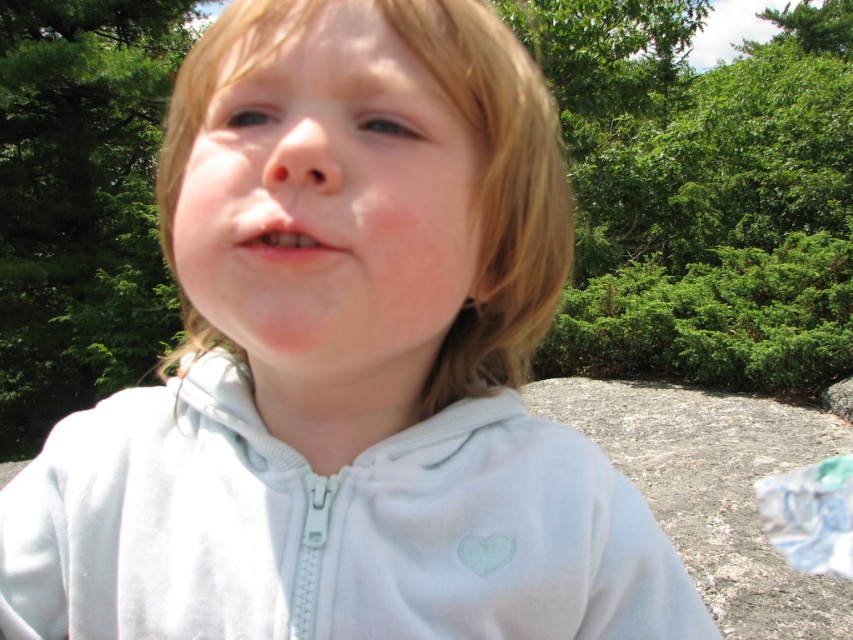
Can you confirm if light blue fleece sweatshirt at center is shorter than pink matte lips at center?

In fact, light blue fleece sweatshirt at center may be taller than pink matte lips at center.

Who is lower down, light blue fleece sweatshirt at center or pink matte lips at center?

light blue fleece sweatshirt at center is below.

Is point (155, 552) in front of point (265, 221)?

No.

Image resolution: width=853 pixels, height=640 pixels. Identify the location of light blue fleece sweatshirt at center. (328, 529).

Can you confirm if light blue fleece sweatshirt at center is bigger than smooth skin face at center?

Incorrect, light blue fleece sweatshirt at center is not larger than smooth skin face at center.

Is point (444, 477) farther from camera compared to point (430, 328)?

Yes, it is.

Locate an element on the screen. light blue fleece sweatshirt at center is located at coordinates (328, 529).

Is smooth skin face at center closer to the viewer compared to pink matte lips at center?

No, smooth skin face at center is behind pink matte lips at center.

Between point (260, 70) and point (294, 244), which one is positioned behind?

Positioned behind is point (260, 70).

Which is in front, point (349, 204) or point (248, 243)?

Point (349, 204)

Where is `smooth skin face at center`? The width and height of the screenshot is (853, 640). smooth skin face at center is located at coordinates (317, 188).